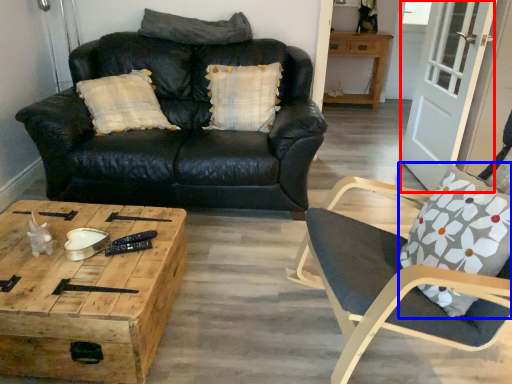
Question: Which of the following is the closest to the observer, screen door (highlighted by a red box) or throw pillow (highlighted by a blue box)?

Choices:
 (A) screen door
 (B) throw pillow

Answer: (B)